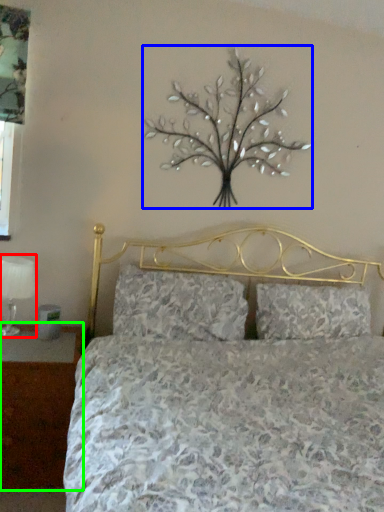
Question: Which is nearer to the table lamp (highlighted by a red box)? flower (highlighted by a blue box) or nightstand (highlighted by a green box).

Choices:
 (A) flower
 (B) nightstand

Answer: (B)